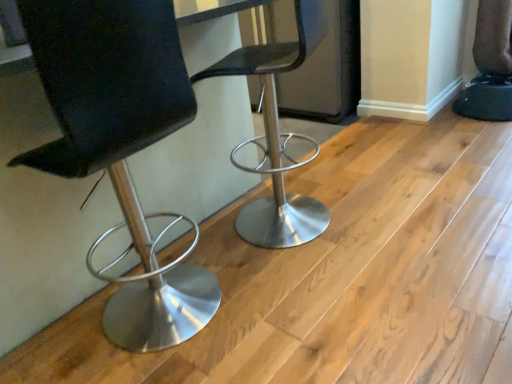
Question: Is black leather chair at left, which is counted as the first chair, starting from the left, positioned beyond the bounds of metallic silver stool at center, the first chair viewed from the right?

Choices:
 (A) yes
 (B) no

Answer: (A)

Question: Could you tell me if black leather chair at left, which is the 2th chair in right-to-left order, is facing metallic silver stool at center, the first chair viewed from the right?

Choices:
 (A) no
 (B) yes

Answer: (A)

Question: Is black leather chair at left, which is counted as the first chair, starting from the left, far away from metallic silver stool at center, marked as the 2th chair in a left-to-right arrangement?

Choices:
 (A) yes
 (B) no

Answer: (B)

Question: Is black leather chair at left, which is counted as the first chair, starting from the left, bigger than metallic silver stool at center, the first chair viewed from the right?

Choices:
 (A) no
 (B) yes

Answer: (B)

Question: From the image's perspective, is black leather chair at left, which is the 2th chair in right-to-left order, under metallic silver stool at center, marked as the 2th chair in a left-to-right arrangement?

Choices:
 (A) no
 (B) yes

Answer: (B)

Question: Considering the relative sizes of black leather chair at left, which is counted as the first chair, starting from the left, and metallic silver stool at center, the first chair viewed from the right, in the image provided, is black leather chair at left, which is counted as the first chair, starting from the left, smaller than metallic silver stool at center, the first chair viewed from the right,?

Choices:
 (A) yes
 (B) no

Answer: (B)

Question: Is metallic silver stool at center, the first chair viewed from the right, wider than black leather chair at left, which is the 2th chair in right-to-left order?

Choices:
 (A) yes
 (B) no

Answer: (A)

Question: Could you tell me if metallic silver stool at center, marked as the 2th chair in a left-to-right arrangement, is facing black leather chair at left, which is counted as the first chair, starting from the left?

Choices:
 (A) no
 (B) yes

Answer: (A)

Question: Would you say black leather chair at left, which is counted as the first chair, starting from the left, is part of metallic silver stool at center, marked as the 2th chair in a left-to-right arrangement,'s contents?

Choices:
 (A) no
 (B) yes

Answer: (A)

Question: Is metallic silver stool at center, marked as the 2th chair in a left-to-right arrangement, positioned beyond the bounds of black leather chair at left, which is the 2th chair in right-to-left order?

Choices:
 (A) no
 (B) yes

Answer: (B)

Question: Is metallic silver stool at center, marked as the 2th chair in a left-to-right arrangement, turned away from black leather chair at left, which is counted as the first chair, starting from the left?

Choices:
 (A) no
 (B) yes

Answer: (A)

Question: Does metallic silver stool at center, the first chair viewed from the right, have a smaller size compared to black leather chair at left, which is the 2th chair in right-to-left order?

Choices:
 (A) yes
 (B) no

Answer: (A)

Question: Is metallic silver stool at center, marked as the 2th chair in a left-to-right arrangement, in front of or behind black leather chair at left, which is the 2th chair in right-to-left order, in the image?

Choices:
 (A) behind
 (B) front

Answer: (A)